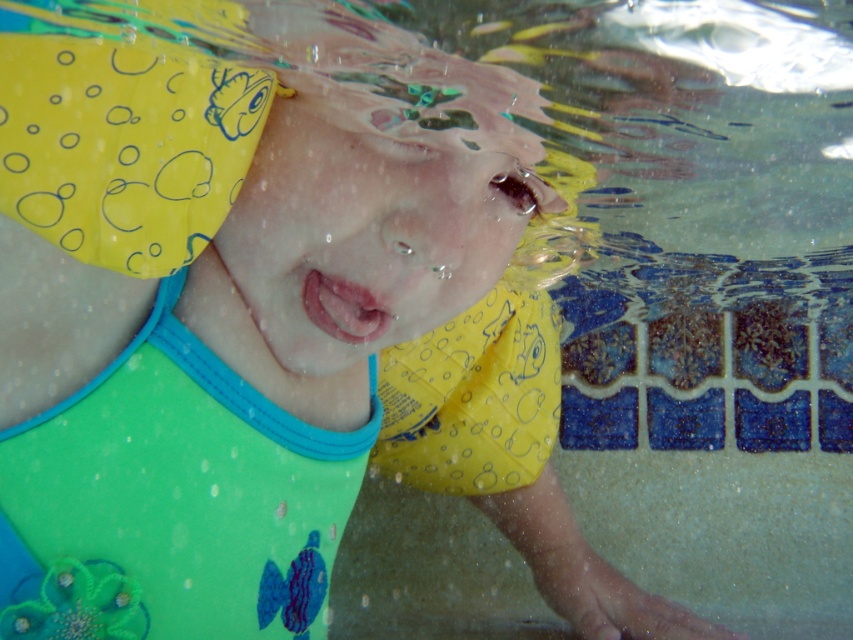
From the picture: Is green fabric bib at center bigger than yellow rubbery swim cap at upper left?

Yes, green fabric bib at center is bigger than yellow rubbery swim cap at upper left.

Can you confirm if green fabric bib at center is positioned to the right of yellow rubbery swim cap at upper left?

Correct, you'll find green fabric bib at center to the right of yellow rubbery swim cap at upper left.

Who is more forward, (x=183, y=394) or (x=173, y=93)?

Point (x=173, y=93) is more forward.

Locate an element on the screen. green fabric bib at center is located at coordinates (172, 500).